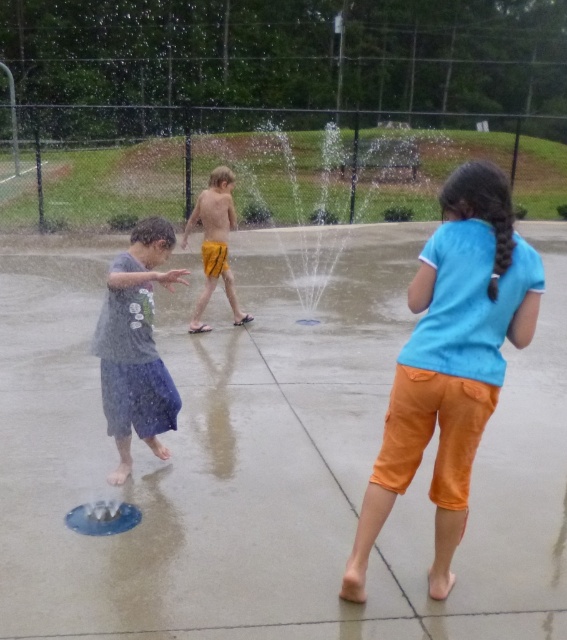
Consider the image. You are a parent supervising children at the water park. You notice two children wearing the gray cotton shirt at left and the yellow matte shorts at center. Which child is positioned lower in the image?

The gray cotton shirt at left is positioned below the yellow matte shorts at center, so the child wearing the gray cotton shirt at left is lower in the image.

You are a parent at the water park and want to ensure your child stays dry. You see the gray cotton shirt at left and the yellow matte shorts at center. Which clothing item is more likely to get soaked first when the water jets activate?

The gray cotton shirt at left is thinner than the yellow matte shorts at center, so the gray cotton shirt at left will get soaked first when the water jets activate because thinner materials absorb water faster.